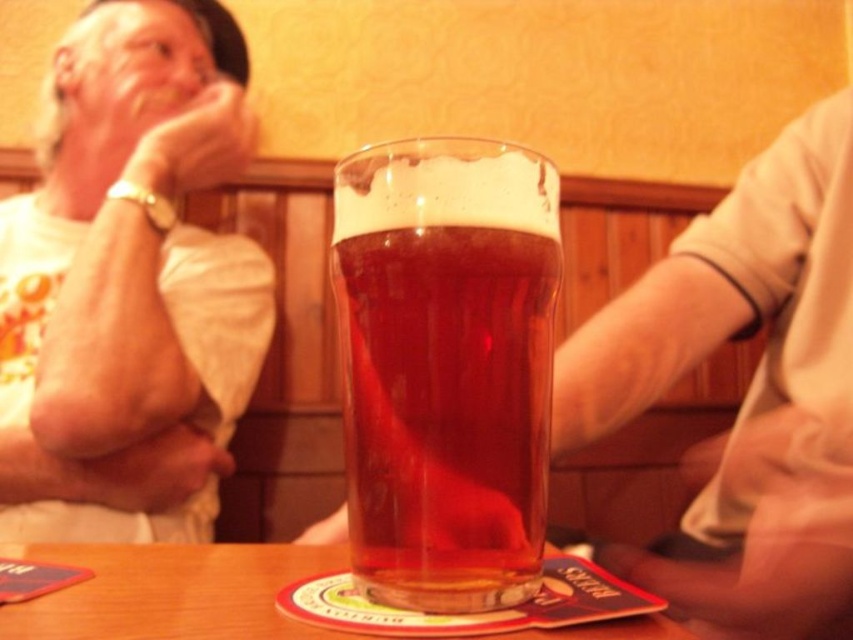
You have a large pizza that is 30 cm in diameter. You want to place it on the wooden table at center. Can the translucent glass beer at center fit on the table along with the pizza without overlapping?

The translucent glass beer at center is narrower than the wooden table at center, but since the pizza is 30 cm in diameter, we need to know the table size to determine if both can fit. The given information only states the glass is smaller than the table, not the table dimensions.

You are a customer in a pub and want to place your phone on the wooden table at center. However, there is a white cotton shirt at upper left on the table. Can you place your phone there without moving the shirt?

The white cotton shirt at upper left is positioned over wooden table at center, so placing the phone there would require moving the shirt to avoid covering it.